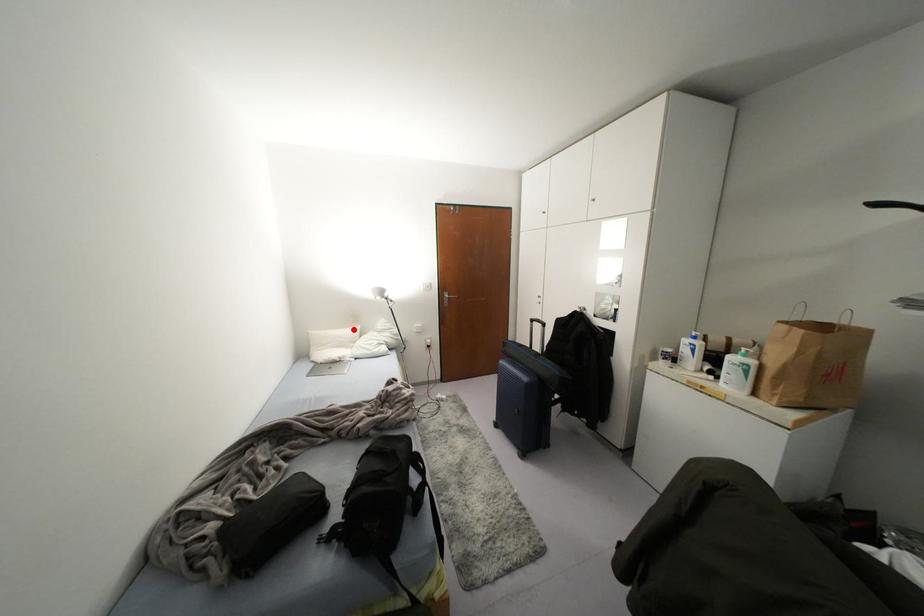
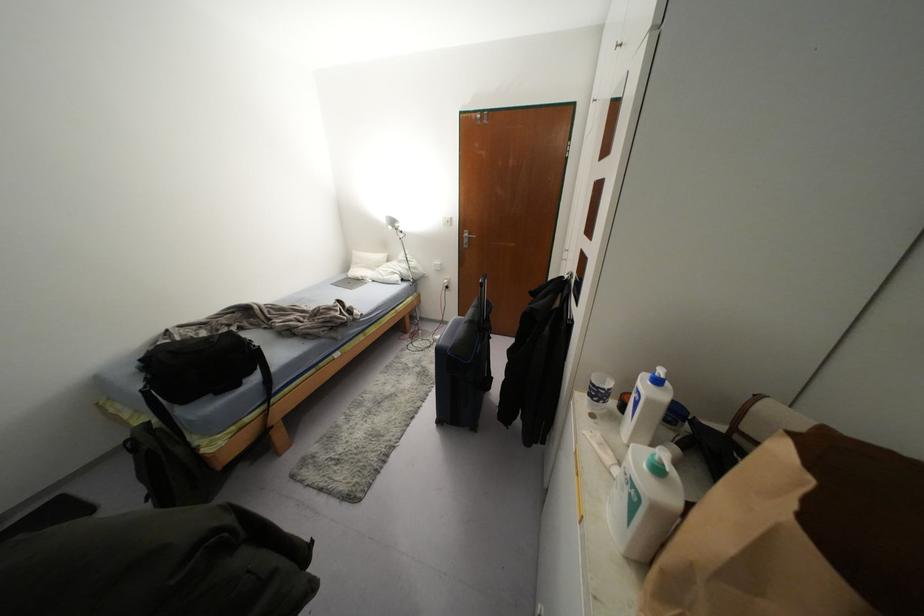
Question: I am providing you with two images of the same scene from different viewpoints. Given a red point in image1, look at the same physical point in image2. Is it:

Choices:
 (A) Closer to the viewpoint
 (B) Farther from the viewpoint

Answer: (A)